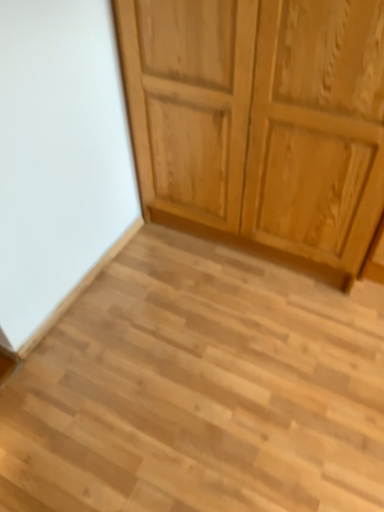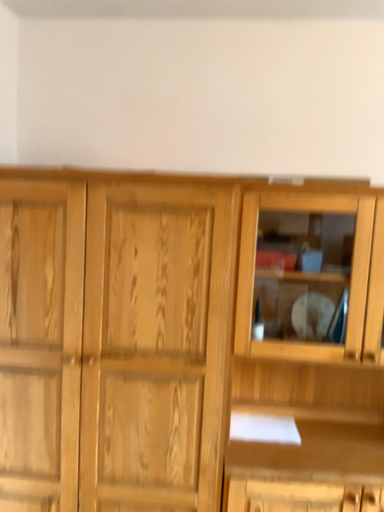
Question: Which way did the camera rotate in the video?

Choices:
 (A) rotated right
 (B) rotated left

Answer: (A)